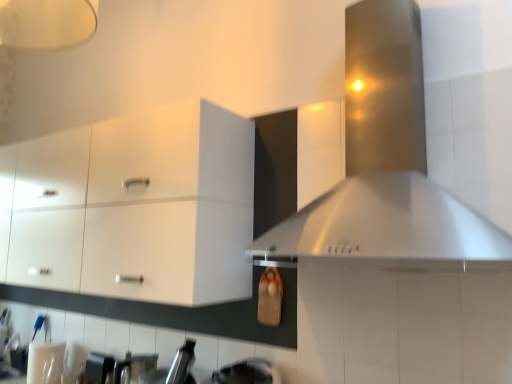
Question: Is stainless steel vent at upper right taller or shorter than white glossy cabinet at upper left?

Choices:
 (A) tall
 (B) short

Answer: (A)

Question: Is stainless steel vent at upper right inside the boundaries of white glossy cabinet at upper left, or outside?

Choices:
 (A) outside
 (B) inside

Answer: (A)

Question: Which object is positioned farthest from the stainless steel vent at upper right?

Choices:
 (A) white glossy cabinet at upper left
 (B) metallic silver toaster at lower left

Answer: (B)

Question: Estimate the real-world distances between objects in this image. Which object is closer to the metallic silver toaster at lower left?

Choices:
 (A) white glossy cabinet at upper left
 (B) stainless steel vent at upper right

Answer: (A)